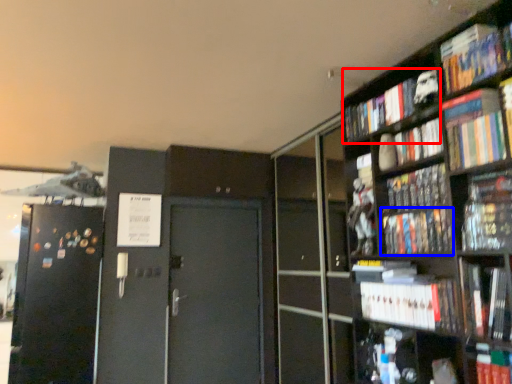
Question: Which object appears closest to the camera in this image, book (highlighted by a red box) or book (highlighted by a blue box)?

Choices:
 (A) book
 (B) book

Answer: (B)